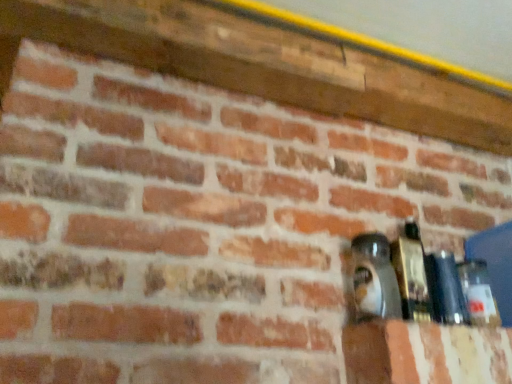
Question: Is clear glass bottle at right, positioned as the first bottle in right-to-left order, to the right of matte black bottle at right, the 2th bottle in the right-to-left sequence, from the viewer's perspective?

Choices:
 (A) yes
 (B) no

Answer: (A)

Question: Is clear glass bottle at right, positioned as the first bottle in right-to-left order, next to matte black bottle at right, placed as the third bottle when sorted from left to right?

Choices:
 (A) yes
 (B) no

Answer: (A)

Question: From the image's perspective, is clear glass bottle at right, positioned as the first bottle in right-to-left order, below matte black bottle at right, the 2th bottle in the right-to-left sequence?

Choices:
 (A) no
 (B) yes

Answer: (B)

Question: Does clear glass bottle at right, marked as the fourth bottle in a left-to-right arrangement, have a larger size compared to matte black bottle at right, the 2th bottle in the right-to-left sequence?

Choices:
 (A) no
 (B) yes

Answer: (A)

Question: Does clear glass bottle at right, marked as the fourth bottle in a left-to-right arrangement, have a smaller size compared to matte black bottle at right, placed as the third bottle when sorted from left to right?

Choices:
 (A) no
 (B) yes

Answer: (B)

Question: Is clear glass bottle at right, positioned as the first bottle in right-to-left order, positioned far away from matte black bottle at right, placed as the third bottle when sorted from left to right?

Choices:
 (A) yes
 (B) no

Answer: (B)

Question: From a real-world perspective, is matte black bottle at right, which is the 4th bottle in right-to-left order, beneath clear glass bottle at right, marked as the fourth bottle in a left-to-right arrangement?

Choices:
 (A) no
 (B) yes

Answer: (A)

Question: Would you say matte black bottle at right, which is the 4th bottle in right-to-left order, is a long distance from clear glass bottle at right, marked as the fourth bottle in a left-to-right arrangement?

Choices:
 (A) no
 (B) yes

Answer: (A)

Question: Does matte black bottle at right, the first bottle viewed from the left, have a greater width compared to clear glass bottle at right, marked as the fourth bottle in a left-to-right arrangement?

Choices:
 (A) no
 (B) yes

Answer: (B)

Question: Is matte black bottle at right, the first bottle viewed from the left, aimed at clear glass bottle at right, positioned as the first bottle in right-to-left order?

Choices:
 (A) yes
 (B) no

Answer: (B)

Question: Considering the relative sizes of matte black bottle at right, which is the 4th bottle in right-to-left order, and clear glass bottle at right, positioned as the first bottle in right-to-left order, in the image provided, is matte black bottle at right, which is the 4th bottle in right-to-left order, smaller than clear glass bottle at right, positioned as the first bottle in right-to-left order,?

Choices:
 (A) yes
 (B) no

Answer: (B)

Question: Does matte black bottle at right, which is the 4th bottle in right-to-left order, touch clear glass bottle at right, positioned as the first bottle in right-to-left order?

Choices:
 (A) yes
 (B) no

Answer: (B)

Question: Is clear glass bottle at right, marked as the fourth bottle in a left-to-right arrangement, not near matte black bottle at right, the first bottle viewed from the left?

Choices:
 (A) no
 (B) yes

Answer: (A)